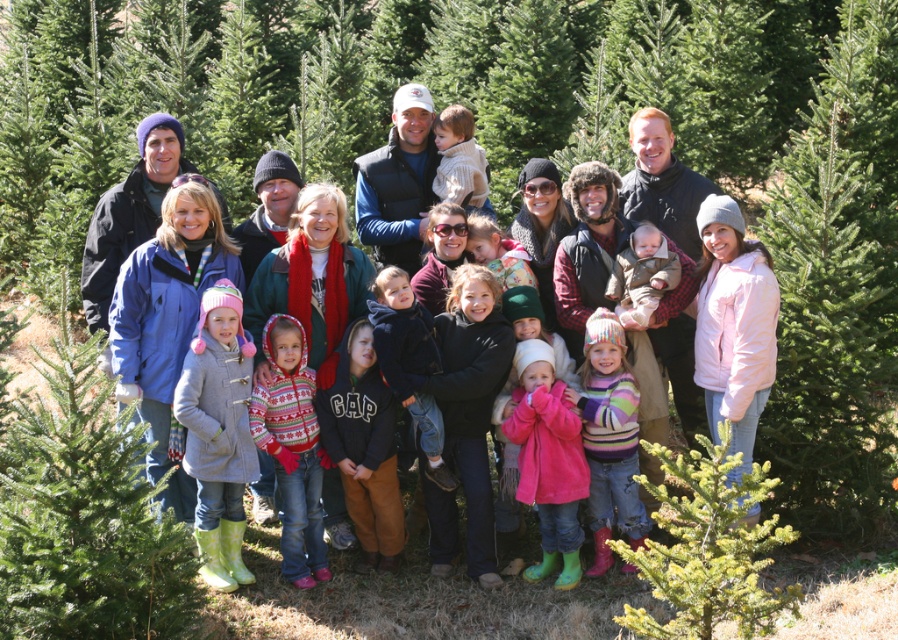
Question: Which object appears closest to the camera in this image?

Choices:
 (A) dark gray hoodie at center
 (B) matte brown baby at center
 (C) green needle-like fir tree at right
 (D) green matte fir tree at lower right

Answer: (D)

Question: Does pink fleece jacket at center come in front of matte black jacket at center?

Choices:
 (A) no
 (B) yes

Answer: (B)

Question: Considering the real-world distances, which object is closest to the dark blue fleece jacket at center?

Choices:
 (A) dark gray hoodie at center
 (B) green textured christmas tree at lower left
 (C) green matte fir tree at lower right
 (D) striped sweater at center

Answer: (A)

Question: Among these points, which one is nearest to the camera?

Choices:
 (A) (383, 282)
 (B) (629, 499)
 (C) (447, 170)
 (D) (432, 305)

Answer: (B)

Question: Can you confirm if dark gray hoodie at center is positioned above red knitted sweater at center?

Choices:
 (A) yes
 (B) no

Answer: (B)

Question: Observing the image, what is the correct spatial positioning of pink fleece jacket at center in reference to fluffy white sweater at center?

Choices:
 (A) left
 (B) right

Answer: (B)